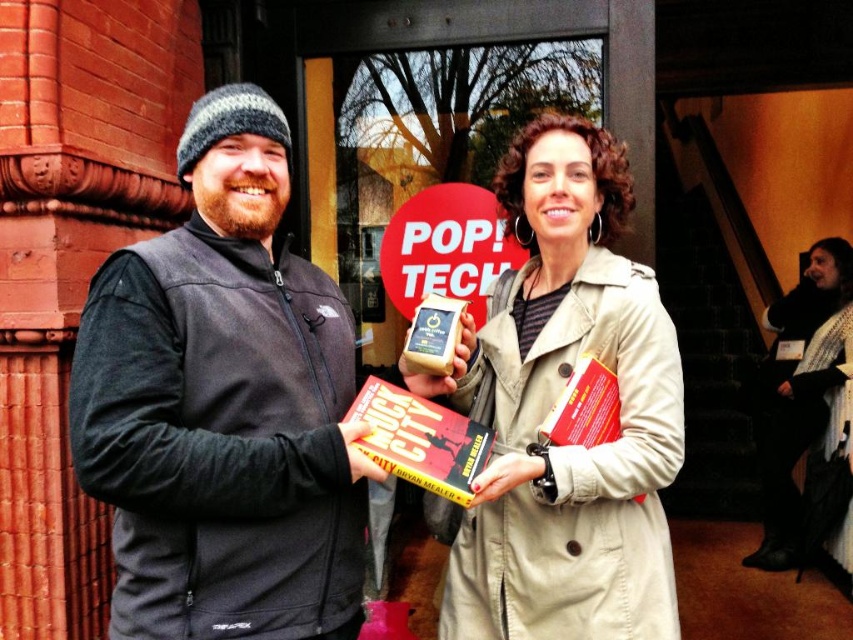
What is the 2D coordinate of the beige trench coat at center?

The beige trench coat at center is located at the 2D coordinate point of (552, 406).